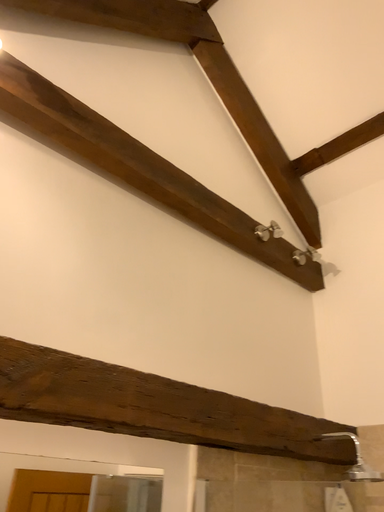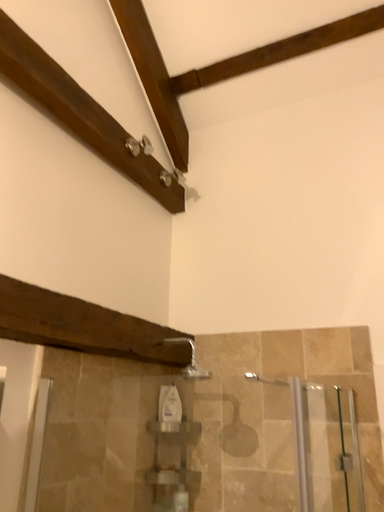
Question: How did the camera likely rotate when shooting the video?

Choices:
 (A) rotated right
 (B) rotated left

Answer: (A)